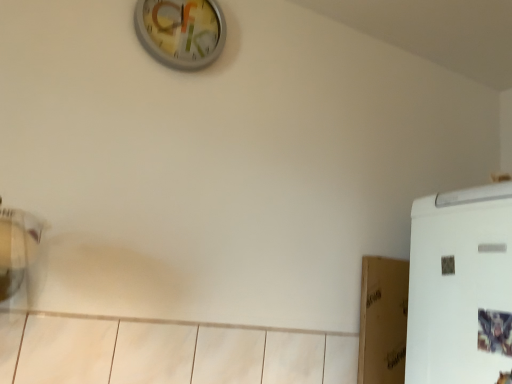
The width and height of the screenshot is (512, 384). What do you see at coordinates (181, 31) in the screenshot?
I see `metallic silver clock at upper center` at bounding box center [181, 31].

Find the location of a particular element. This screenshot has width=512, height=384. metallic silver clock at upper center is located at coordinates (181, 31).

Locate an element on the screen. The width and height of the screenshot is (512, 384). metallic silver clock at upper center is located at coordinates (181, 31).